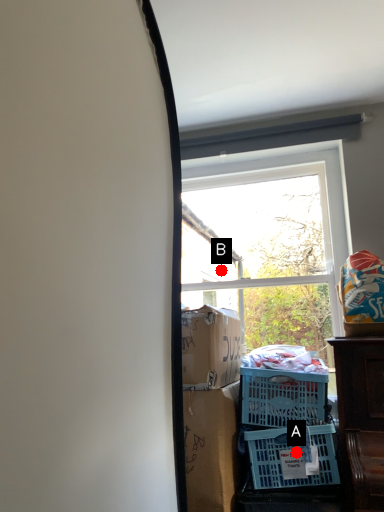
Question: Two points are circled on the image, labeled by A and B beside each circle. Which point appears closest to the camera in this image?

Choices:
 (A) A is closer
 (B) B is closer

Answer: (A)